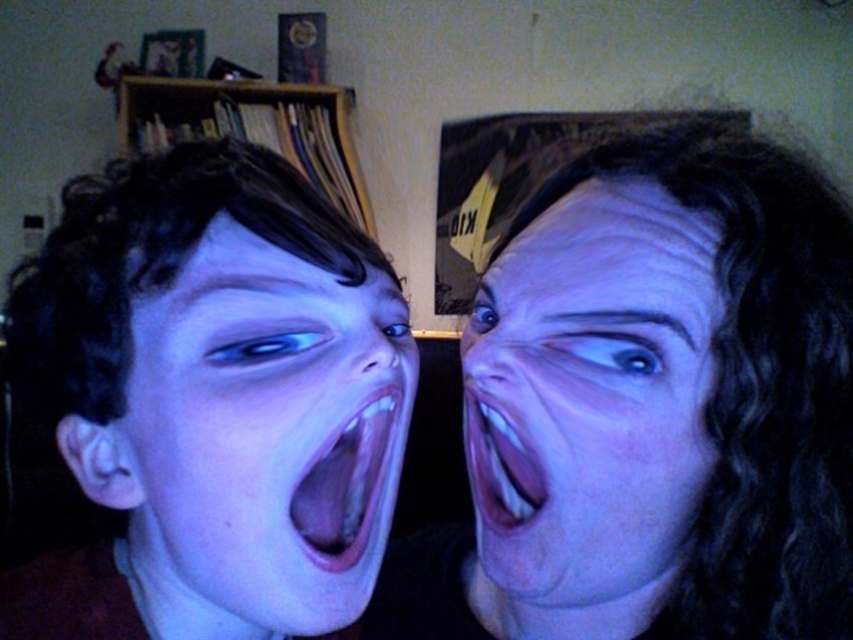
Is point (393, 339) closer to viewer compared to point (467, 392)?

Yes, point (393, 339) is in front of point (467, 392).

You are a GUI agent. You are given a task and a screenshot of the screen. Output one action in this format:
    pyautogui.click(x=<x>, y=<y>)
    Task: Click on the blue matte face at left
    The image size is (853, 640).
    Given the screenshot: What is the action you would take?
    pyautogui.click(x=260, y=442)

This screenshot has height=640, width=853. In order to click on matte black hair at right in this screenshot , I will do `click(653, 408)`.

Is point (631, 241) closer to viewer compared to point (503, 500)?

Yes, point (631, 241) is closer to viewer.

Locate an element on the screen. matte black hair at right is located at coordinates (653, 408).

Does matte skin face at right have a greater width compared to pink flesh-colored mouth at center?

Indeed, matte skin face at right has a greater width compared to pink flesh-colored mouth at center.

Who is higher up, matte skin face at right or pink flesh-colored mouth at center?

pink flesh-colored mouth at center

The width and height of the screenshot is (853, 640). Describe the element at coordinates (590, 396) in the screenshot. I see `matte skin face at right` at that location.

Find the location of a particular element. This screenshot has height=640, width=853. matte skin face at right is located at coordinates (590, 396).